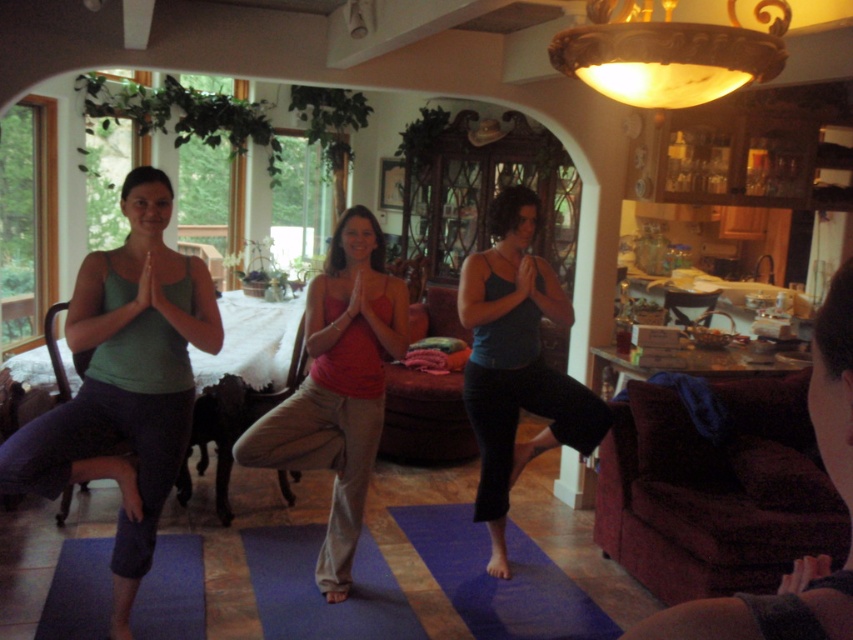
You are a photographer setting up a shoot in this room. You want to place a small prop exactly where the green matte tank top at center is currently located. What coordinates should you use?

The coordinates for the green matte tank top at center are point (125, 381).

You are a photographer setting up a shoot in the room where three people are practicing yoga on a blue yoga mat. You need to position a spotlight at the point marked by coordinates point (x=338, y=387). What object will the spotlight illuminate?

The spotlight positioned at point (x=338, y=387) will illuminate the matte red tank top at center.